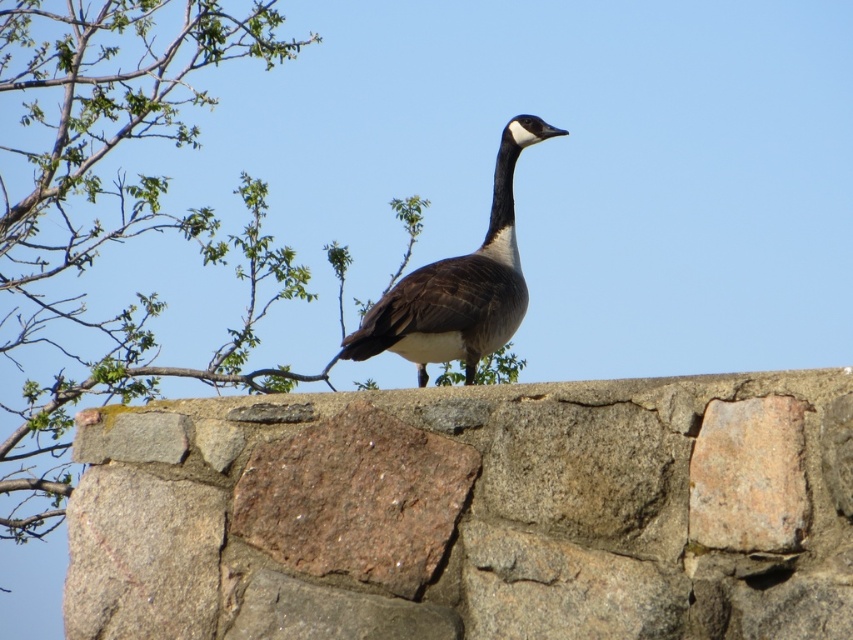
You are standing in front of the stone wall where the Canada goose is sitting. You notice two points marked on the wall at coordinates point [276,260] and point [538,122]. Which point is closer to you?

Point [276,260] is further to the viewer than point [538,122], so point [276,260] is closer to you.

You are a birdwatcher observing the scene. You notice the green leafy branches at upper left and the dark brown feathered goose at center. Which object is positioned higher in the image?

The green leafy branches at upper left is located above the dark brown feathered goose at center, so it is positioned higher in the image.